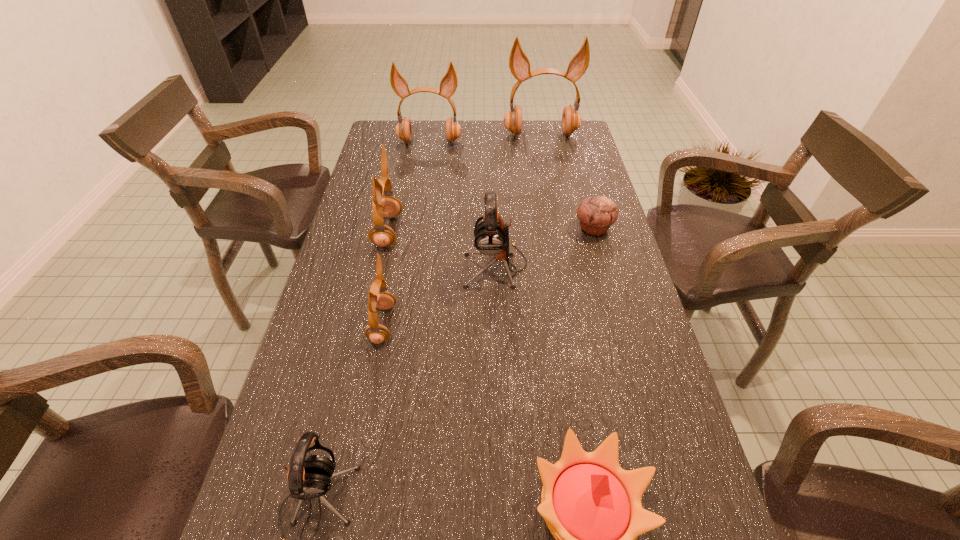
Select which earphone is the third closest to the nearest earphone. Please provide its 2D coordinates. Your answer should be formatted as a tuple, i.e. [(x, y)], where the tuple contains the x and y coordinates of a point satisfying the conditions above.

[(387, 206)]

Where is `brown earphone that is the second nearest to the rightmost brown earphone`? brown earphone that is the second nearest to the rightmost brown earphone is located at coordinates (387, 206).

Select which brown earphone is the second closest to the second shortest object. Please provide its 2D coordinates. Your answer should be formatted as a tuple, i.e. [(x, y)], where the tuple contains the x and y coordinates of a point satisfying the conditions above.

[(387, 206)]

The height and width of the screenshot is (540, 960). I want to click on free space that satisfies the following two spatial constraints: 1. on the front-facing side of the second tallest object; 2. on the left side of the bigger black earphone, so click(410, 265).

I want to click on vacant space that satisfies the following two spatial constraints: 1. on the front-facing side of the fifth shortest earphone; 2. on the front-facing side of the third nearest object, so click(x=401, y=324).

Identify the location of free location that satisfies the following two spatial constraints: 1. on the front-facing side of the fifth shortest earphone; 2. on the right side of the shortest object. click(x=417, y=228).

The height and width of the screenshot is (540, 960). Identify the location of free location that satisfies the following two spatial constraints: 1. on the front-facing side of the third biggest brown earphone; 2. on the right side of the farther black earphone. (380, 265).

The width and height of the screenshot is (960, 540). Identify the location of vacant space that satisfies the following two spatial constraints: 1. on the front side of the shortest object; 2. on the front-facing side of the second nearest brown earphone. (595, 231).